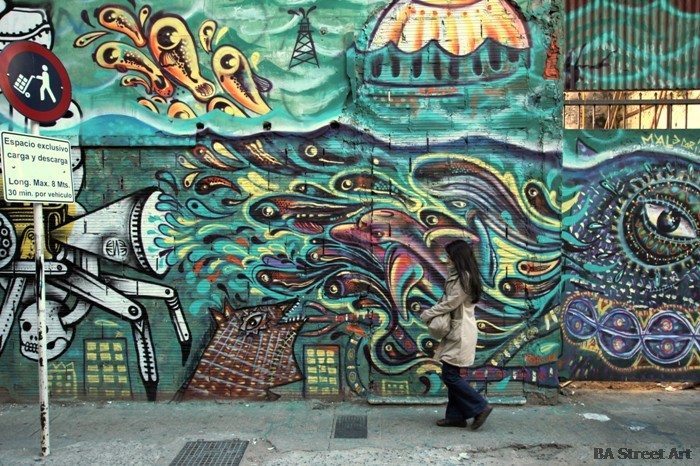
At what (x,y) coordinates should I click in order to perform the action: click on vents. Please return your answer as a coordinate pair (x, y). Looking at the image, I should click on (343, 423), (203, 451).